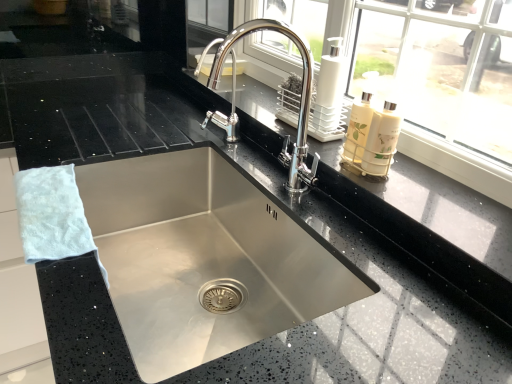
Question: From the image's perspective, would you say white fluffy hand towel at left is shown under white glossy soap dispenser at upper right?

Choices:
 (A) yes
 (B) no

Answer: (A)

Question: Does white fluffy hand towel at left have a greater width compared to white glossy soap dispenser at upper right?

Choices:
 (A) no
 (B) yes

Answer: (B)

Question: Are white fluffy hand towel at left and white glossy soap dispenser at upper right beside each other?

Choices:
 (A) yes
 (B) no

Answer: (B)

Question: Can you confirm if white fluffy hand towel at left is shorter than white glossy soap dispenser at upper right?

Choices:
 (A) no
 (B) yes

Answer: (B)

Question: Can you confirm if white fluffy hand towel at left is bigger than white glossy soap dispenser at upper right?

Choices:
 (A) yes
 (B) no

Answer: (A)

Question: Is white fluffy hand towel at left located outside white glossy soap dispenser at upper right?

Choices:
 (A) yes
 (B) no

Answer: (A)

Question: Is white glossy soap dispenser at upper right oriented away from white fluffy hand towel at left?

Choices:
 (A) no
 (B) yes

Answer: (A)

Question: Can you confirm if white glossy soap dispenser at upper right is taller than white fluffy hand towel at left?

Choices:
 (A) yes
 (B) no

Answer: (A)

Question: Considering the relative positions of white glossy soap dispenser at upper right and white fluffy hand towel at left in the image provided, is white glossy soap dispenser at upper right behind white fluffy hand towel at left?

Choices:
 (A) yes
 (B) no

Answer: (A)

Question: Does white glossy soap dispenser at upper right appear on the left side of white fluffy hand towel at left?

Choices:
 (A) no
 (B) yes

Answer: (A)

Question: Considering the relative sizes of white glossy soap dispenser at upper right and white fluffy hand towel at left in the image provided, is white glossy soap dispenser at upper right shorter than white fluffy hand towel at left?

Choices:
 (A) no
 (B) yes

Answer: (A)

Question: Does white glossy soap dispenser at upper right appear on the right side of white fluffy hand towel at left?

Choices:
 (A) yes
 (B) no

Answer: (A)

Question: Does white fluffy hand towel at left have a lesser height compared to polished chrome faucet at center?

Choices:
 (A) yes
 (B) no

Answer: (A)